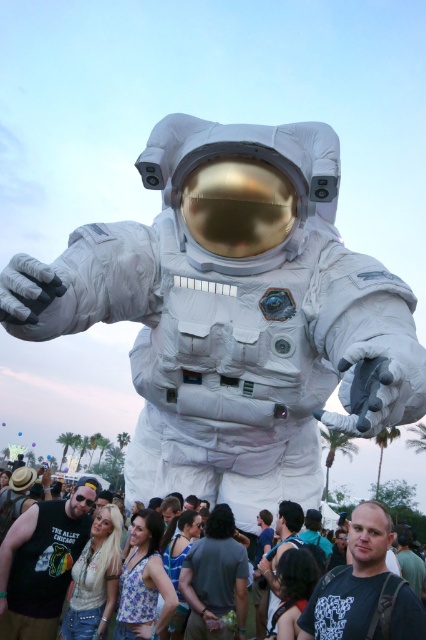
Question: Does black t-shirt at center lie behind dark gray t-shirt at center?

Choices:
 (A) no
 (B) yes

Answer: (B)

Question: Is dark gray t-shirt at center closer to the viewer compared to white fabric crowd at center?

Choices:
 (A) yes
 (B) no

Answer: (A)

Question: Which of the following is the closest to the observer?

Choices:
 (A) (14, 532)
 (B) (302, 150)
 (C) (8, 564)

Answer: (B)

Question: Which point appears closest to the camera in this image?

Choices:
 (A) (368, 512)
 (B) (17, 538)
 (C) (29, 592)
 (D) (209, 305)

Answer: (A)

Question: Is the position of dark gray t-shirt at center less distant than that of white fabric crowd at center?

Choices:
 (A) no
 (B) yes

Answer: (B)

Question: Which object is farther from the camera taking this photo?

Choices:
 (A) white fabric crowd at center
 (B) white fabric astronaut at center

Answer: (A)